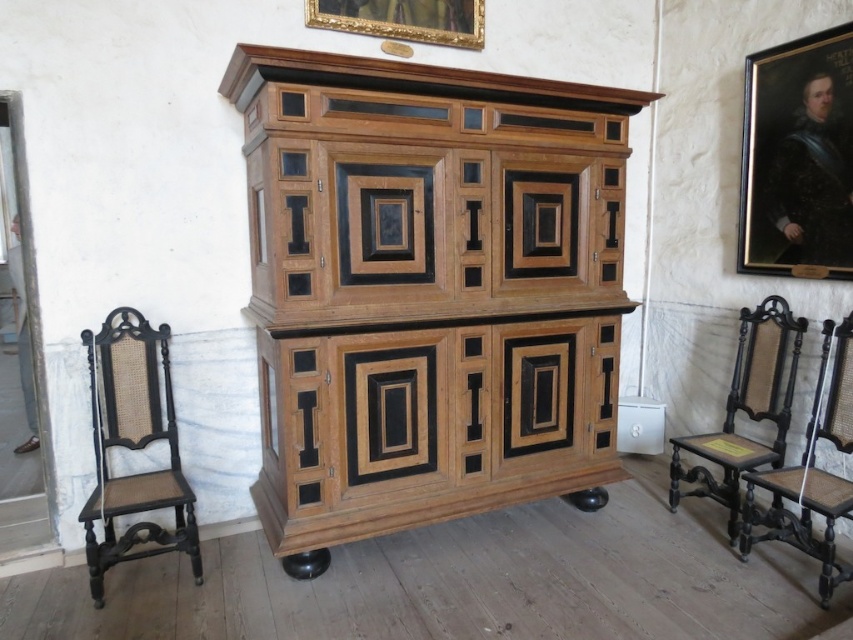
Is black wood chair at left bigger than dark wood chair at right?

Incorrect, black wood chair at left is not larger than dark wood chair at right.

Describe the element at coordinates (132, 445) in the screenshot. The width and height of the screenshot is (853, 640). I see `black wood chair at left` at that location.

Does point (140, 390) come closer to viewer compared to point (750, 461)?

Yes, it is.

At what (x,y) coordinates should I click in order to perform the action: click on black wood chair at left. Please return your answer as a coordinate pair (x, y). Looking at the image, I should click on (132, 445).

Does wooden portrait frame at upper right appear under black wood chair at right?

Actually, wooden portrait frame at upper right is above black wood chair at right.

Which is above, wooden portrait frame at upper right or black wood chair at right?

Positioned higher is wooden portrait frame at upper right.

Is point (762, 51) farther from viewer compared to point (848, 493)?

That is True.

Identify the location of wooden portrait frame at upper right. This screenshot has width=853, height=640. (798, 156).

Measure the distance between natural wood armoire at center and black wood chair at left.

They are 34.01 inches apart.

The image size is (853, 640). Describe the element at coordinates (427, 291) in the screenshot. I see `natural wood armoire at center` at that location.

Measure the distance between point (263, 518) and camera.

The distance of point (263, 518) from camera is 9.57 feet.

Locate an element on the screen. Image resolution: width=853 pixels, height=640 pixels. natural wood armoire at center is located at coordinates [427, 291].